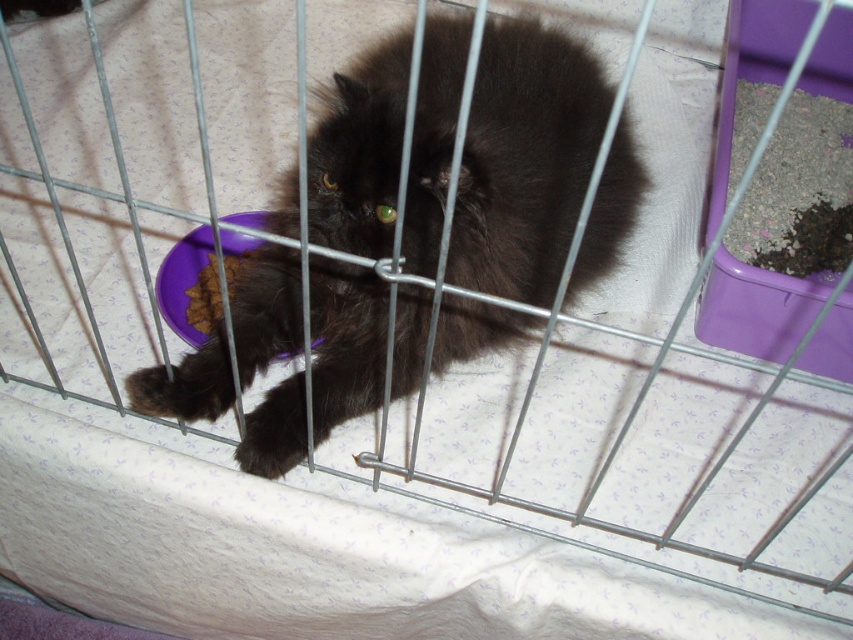
You are a veterinarian examining the image of a black cat in a metal cage. The cat is sitting at the point marked by coordinates point (524, 161). The cage has a purple plastic bowl and a white fabric liner. Where is the purple plastic bowl located relative to the cat?

The purple plastic bowl is located to the right side of the fluffy black cat at center, as the point (524, 161) marks the cat, and the bowl is described as being to the right side of the cage.

You are a photographer standing at a certain distance from the fluffy black cat at center. You want to take a closeup photo of the cat without getting too close. What is the minimum distance you should maintain to ensure the cat remains in focus?

The minimum distance you should maintain to ensure the fluffy black cat at center remains in focus is 28.81 inches, as that is the distance between the cat and the camera.

From the picture: You are a veterinarian examining the cage setup. You need to determine if the fluffy black cat at center can easily reach the brown crumbly food at lower left. Based on their positions, what do you observe?

The fluffy black cat at center is closer to the viewer than the brown crumbly food at lower left, meaning the cat would have to stretch or move further to reach the food, which might be inconvenient.